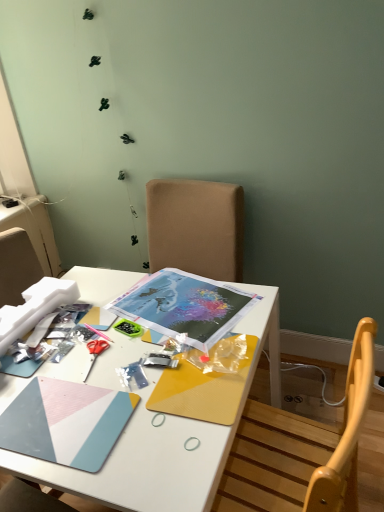
Identify the location of red plastic scissors at center-left. This screenshot has height=512, width=384. (94, 354).

Measure the distance between red plastic scissors at center-left and camera.

The distance of red plastic scissors at center-left from camera is 3.37 feet.

What is the approximate width of red plastic scissors at center-left?

→ The width of red plastic scissors at center-left is 6.35 inches.

Image resolution: width=384 pixels, height=512 pixels. Describe the element at coordinates (94, 354) in the screenshot. I see `red plastic scissors at center-left` at that location.

Locate an element on the screen. The height and width of the screenshot is (512, 384). white matte desk at center is located at coordinates 166,441.

Describe the element at coordinates (166, 441) in the screenshot. I see `white matte desk at center` at that location.

Find the location of a particular element. This screenshot has height=512, width=384. red plastic scissors at center-left is located at coordinates (94, 354).

Is white matte desk at center to the left of red plastic scissors at center-left from the viewer's perspective?

In fact, white matte desk at center is to the right of red plastic scissors at center-left.

Which object is further away from the camera, white matte desk at center or red plastic scissors at center-left?

red plastic scissors at center-left is further away from the camera.

Which point is more forward, (79, 475) or (93, 359)?

The point (79, 475) is in front.

From the image's perspective, which one is positioned higher, white matte desk at center or red plastic scissors at center-left?

From the image's view, red plastic scissors at center-left is above.

From a real-world perspective, which is physically above, white matte desk at center or red plastic scissors at center-left?

red plastic scissors at center-left is physically above.

Can you confirm if white matte desk at center is thinner than red plastic scissors at center-left?

No.

Between white matte desk at center and red plastic scissors at center-left, which one has less height?

red plastic scissors at center-left is shorter.

Is white matte desk at center bigger than red plastic scissors at center-left?

Indeed, white matte desk at center has a larger size compared to red plastic scissors at center-left.

Choose the correct answer: Is white matte desk at center inside red plastic scissors at center-left or outside it?

white matte desk at center is not enclosed by red plastic scissors at center-left.

Are white matte desk at center and red plastic scissors at center-left far apart?

No, white matte desk at center is not far away from red plastic scissors at center-left.

Looking at this image, is white matte desk at center positioned with its back to red plastic scissors at center-left?

No, white matte desk at center's orientation is not away from red plastic scissors at center-left.

Measure the distance between white matte desk at center and red plastic scissors at center-left.

They are 13.63 inches apart.

Where is `desk lying on the right of red plastic scissors at center-left`? This screenshot has width=384, height=512. desk lying on the right of red plastic scissors at center-left is located at coordinates (166, 441).

Which object is positioned more to the left, red plastic scissors at center-left or white matte desk at center?

red plastic scissors at center-left.

Which object is further away from the camera taking this photo, red plastic scissors at center-left or white matte desk at center?

red plastic scissors at center-left.

Is point (97, 354) closer to camera compared to point (203, 446)?

No, (97, 354) is further to viewer.

From the image's perspective, is red plastic scissors at center-left above white matte desk at center?

Indeed, from the image's perspective, red plastic scissors at center-left is shown above white matte desk at center.

From a real-world perspective, is red plastic scissors at center-left positioned above or below white matte desk at center?

red plastic scissors at center-left is situated higher than white matte desk at center in the real world.

Consider the image. In terms of width, does red plastic scissors at center-left look wider or thinner when compared to white matte desk at center?

In the image, red plastic scissors at center-left appears to be more narrow than white matte desk at center.

Which of these two, red plastic scissors at center-left or white matte desk at center, stands shorter?

red plastic scissors at center-left is shorter.

Considering the relative sizes of red plastic scissors at center-left and white matte desk at center in the image provided, is red plastic scissors at center-left smaller than white matte desk at center?

Yes.

Does red plastic scissors at center-left contain white matte desk at center?

No, white matte desk at center is located outside of red plastic scissors at center-left.

Is there a large distance between red plastic scissors at center-left and white matte desk at center?

red plastic scissors at center-left is near white matte desk at center, not far away.

Is red plastic scissors at center-left oriented away from white matte desk at center?

Yes, red plastic scissors at center-left is positioned with its back facing white matte desk at center.

What's the angular difference between red plastic scissors at center-left and white matte desk at center's facing directions?

The facing directions of red plastic scissors at center-left and white matte desk at center are 14.8 degrees apart.

This screenshot has width=384, height=512. Find the location of `desk below the red plastic scissors at center-left (from a real-world perspective)`. desk below the red plastic scissors at center-left (from a real-world perspective) is located at coordinates (166, 441).

You are a GUI agent. You are given a task and a screenshot of the screen. Output one action in this format:
    pyautogui.click(x=<x>, y=<y>)
    Task: Click on the scissors that appears on the left of white matte desk at center
    
    Given the screenshot: What is the action you would take?
    pyautogui.click(x=94, y=354)

Image resolution: width=384 pixels, height=512 pixels. I want to click on desk below the red plastic scissors at center-left (from the image's perspective), so click(166, 441).